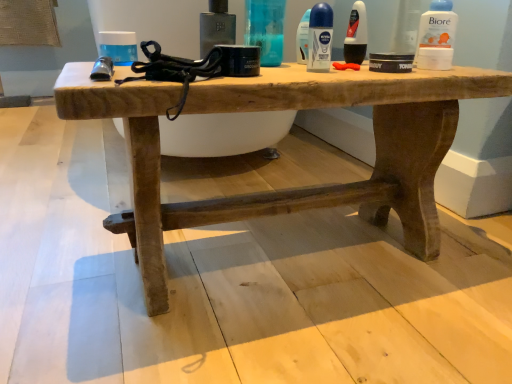
At what (x,y) coordinates should I click in order to perform the action: click on unoccupied region to the right of metallic black toiletry at upper center, the 3th toiletry in the right-to-left sequence. Please return your answer as a coordinate pair (x, y). This screenshot has height=384, width=512. Looking at the image, I should click on (315, 68).